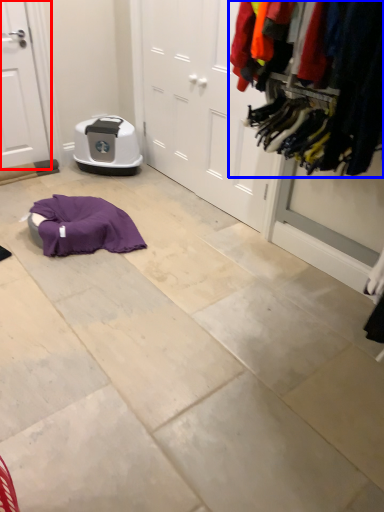
Question: Which object is further to the camera taking this photo, door (highlighted by a red box) or closet (highlighted by a blue box)?

Choices:
 (A) door
 (B) closet

Answer: (A)